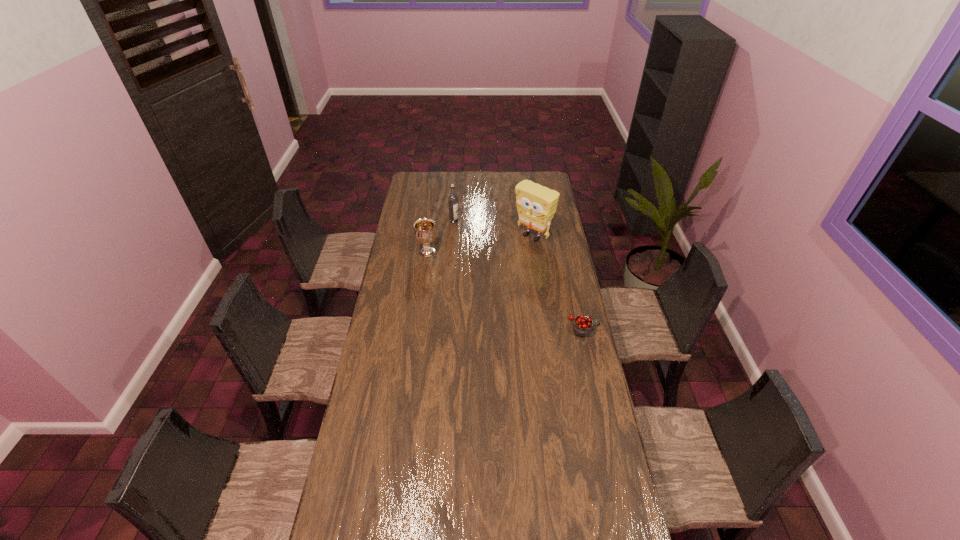
This screenshot has width=960, height=540. I want to click on the third tallest object, so click(425, 233).

This screenshot has height=540, width=960. What are the coordinates of `chalice` in the screenshot? It's located at (425, 233).

The width and height of the screenshot is (960, 540). I want to click on the nearest object, so click(582, 326).

The height and width of the screenshot is (540, 960). What are the coordinates of `pot filled with cherries` in the screenshot? It's located at (582, 326).

Identify the location of the third shortest object. This screenshot has width=960, height=540. (452, 200).

Find the location of a particular element. The image size is (960, 540). the second object from left to right is located at coordinates (452, 200).

The image size is (960, 540). Identify the location of the tallest object. (536, 204).

I want to click on free space located on the right of the chalice, so 510,252.

At what (x,y) coordinates should I click in order to perform the action: click on free location located 0.400m on the label of the second object from left to right. Please return your answer as a coordinate pair (x, y). Looking at the image, I should click on (480, 268).

At what (x,y) coordinates should I click in order to perform the action: click on free space located on the label of the second object from left to right. Please return your answer as a coordinate pair (x, y). The image size is (960, 540). Looking at the image, I should click on (476, 260).